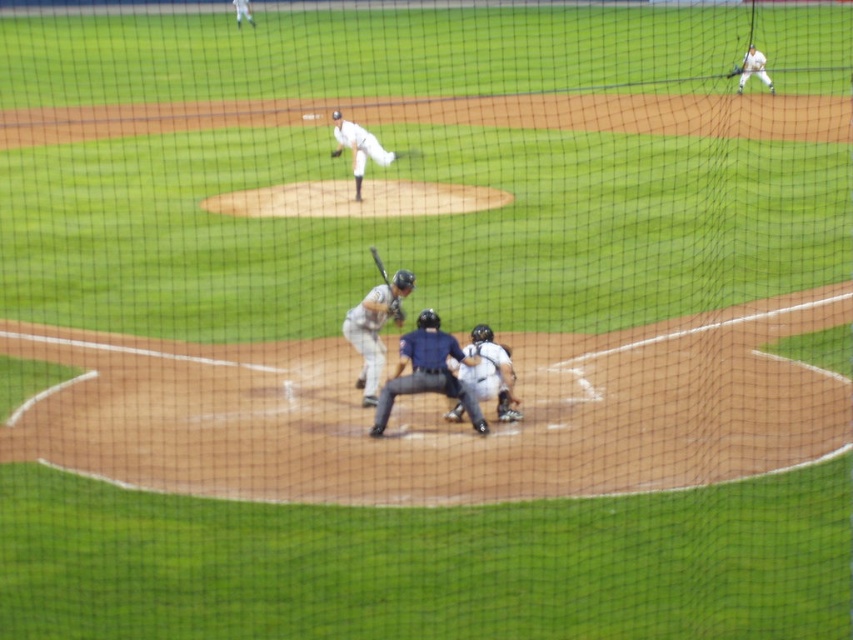
Question: Does dark blue uniform at center appear on the right side of white uniformed man at upper center?

Choices:
 (A) no
 (B) yes

Answer: (B)

Question: Which point is farther from the camera taking this photo?

Choices:
 (A) (369, 250)
 (B) (338, 150)
 (C) (759, 72)
 (D) (514, 401)

Answer: (C)

Question: Which of these objects is positioned closest to the dark brown leather glove at upper center?

Choices:
 (A) dark blue uniform at center
 (B) white uniform at center
 (C) wooden baseball bat at center
 (D) white uniformed player at upper right

Answer: (B)

Question: Is dark blue uniform at center below gray matte bat at center?

Choices:
 (A) yes
 (B) no

Answer: (A)

Question: Does wooden baseball bat at center appear on the right side of dark brown leather glove at upper center?

Choices:
 (A) yes
 (B) no

Answer: (A)

Question: Among these objects, which one is nearest to the camera?

Choices:
 (A) brown leather glove at center
 (B) dark brown leather glove at upper center
 (C) dark blue uniform at center

Answer: (C)